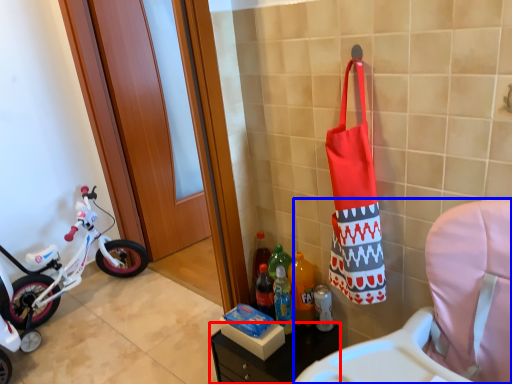
Question: Which object appears closest to the camera in this image, furniture (highlighted by a red box) or rocking chair (highlighted by a blue box)?

Choices:
 (A) furniture
 (B) rocking chair

Answer: (B)